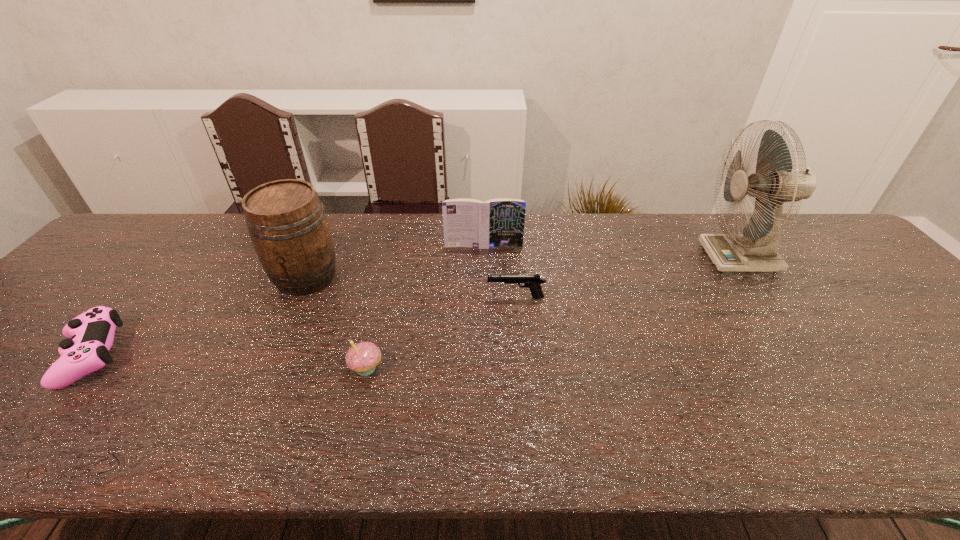
Where is `vacant space located 0.320m on the front-facing side of the tallest object`? The width and height of the screenshot is (960, 540). vacant space located 0.320m on the front-facing side of the tallest object is located at coordinates (596, 258).

Find the location of a particular element. Image resolution: width=960 pixels, height=540 pixels. vacant space situated 0.330m on the front-facing side of the tallest object is located at coordinates (592, 258).

Locate an element on the screen. This screenshot has height=540, width=960. blank space located 0.230m on the side of the cider near the bung hole is located at coordinates pos(262,373).

Image resolution: width=960 pixels, height=540 pixels. I want to click on free space located 0.050m on the front cover of the book, so click(484, 260).

In order to click on free spot located on the back of the third object from left to right in this screenshot , I will do `click(386, 287)`.

Locate an element on the screen. The width and height of the screenshot is (960, 540). vacant space positioned at the aiming end of the gun is located at coordinates (442, 298).

The image size is (960, 540). What are the coordinates of `blank space located at the aiming end of the gun` in the screenshot? It's located at (430, 298).

Where is `free location located at the aiming end of the gun`? free location located at the aiming end of the gun is located at coordinates (411, 298).

Identify the location of free space located on the right of the leftmost object. Image resolution: width=960 pixels, height=540 pixels. (201, 356).

Identify the location of fan that is at the far edge. (775, 182).